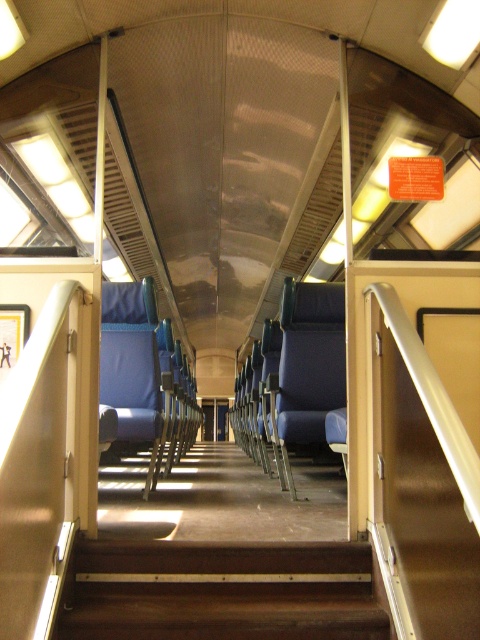
Question: Which of the following is the closest to the observer?

Choices:
 (A) (290, 282)
 (B) (154, 337)

Answer: (B)

Question: Does brown wooden stairs at center appear over matte blue seat at center?

Choices:
 (A) no
 (B) yes

Answer: (A)

Question: Which point is closer to the camera taking this photo?

Choices:
 (A) (319, 385)
 (B) (117, 412)

Answer: (B)

Question: Is blue fabric seat at center thinner than matte blue seat at center?

Choices:
 (A) yes
 (B) no

Answer: (B)

Question: Which of these objects is positioned farthest from the brown wooden stairs at center?

Choices:
 (A) blue fabric seat at center
 (B) matte blue seat at center

Answer: (A)

Question: Is blue fabric seat at center in front of matte blue seat at center?

Choices:
 (A) yes
 (B) no

Answer: (B)